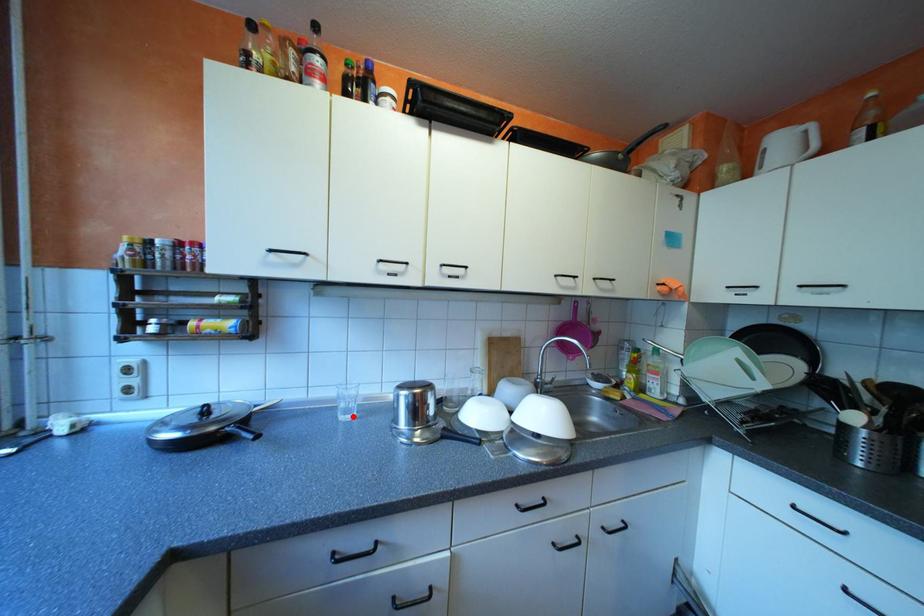
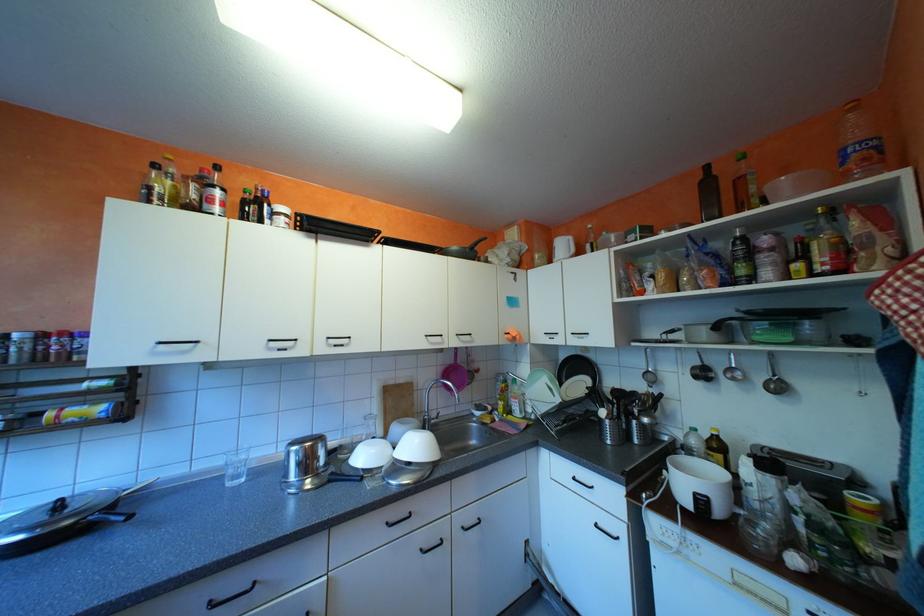
Locate, in the second image, the point that corresponds to the highlighted location in the first image.

(239, 483)